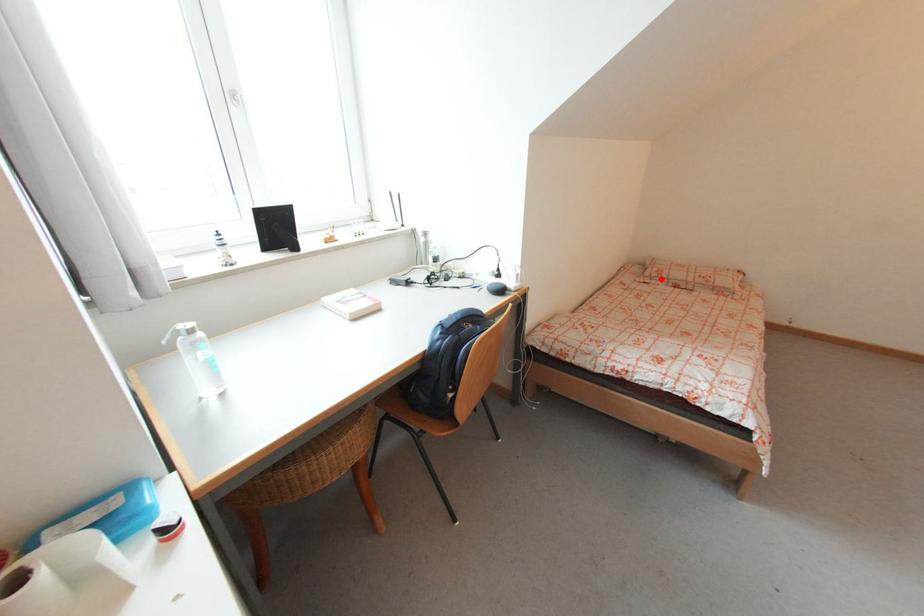
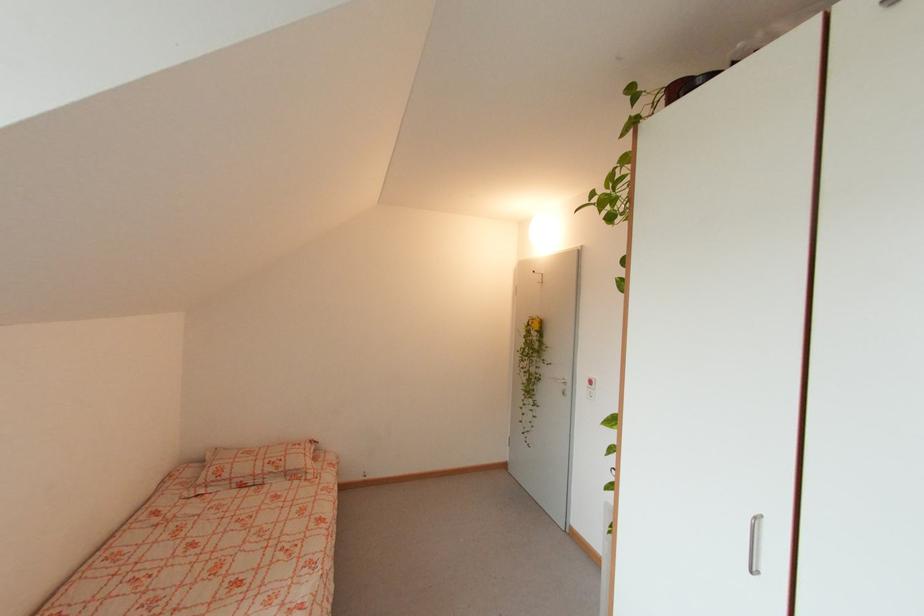
In the second image, find the point that corresponds to the highlighted location in the first image.

(219, 484)